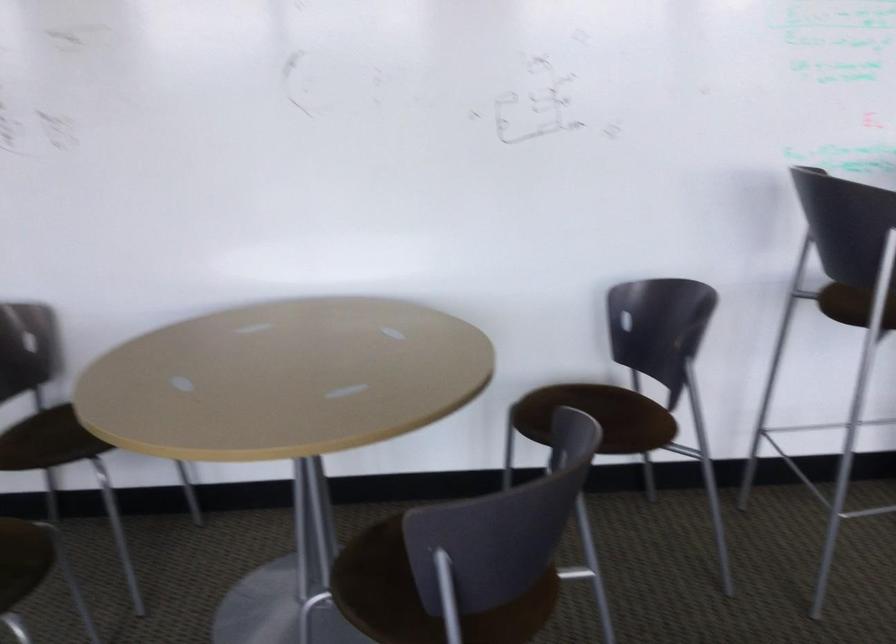
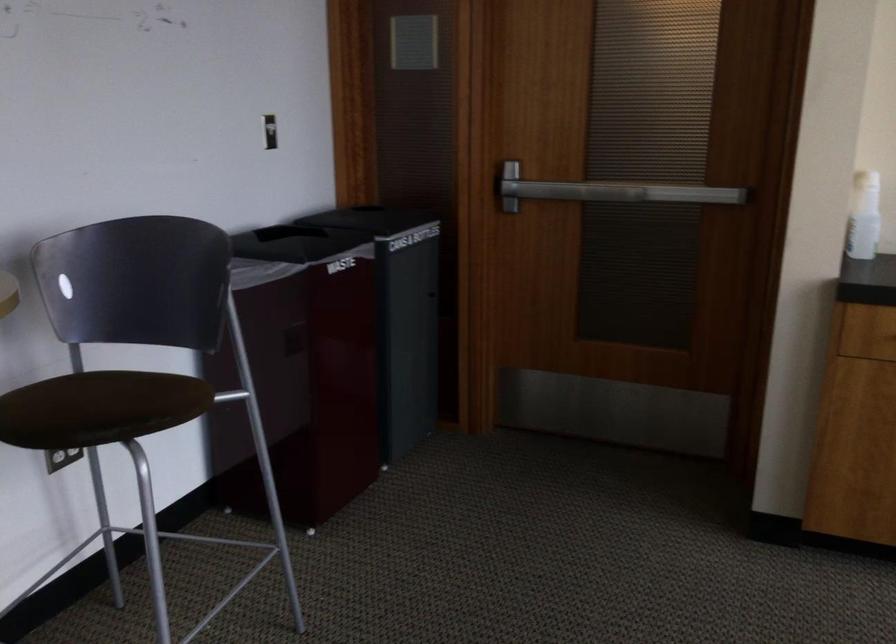
Question: Based on the continuous images, in which direction is the camera rotating? Reply with the corresponding letter.

Choices:
 (A) Left
 (B) Right
 (C) Up
 (D) Down

Answer: (B)